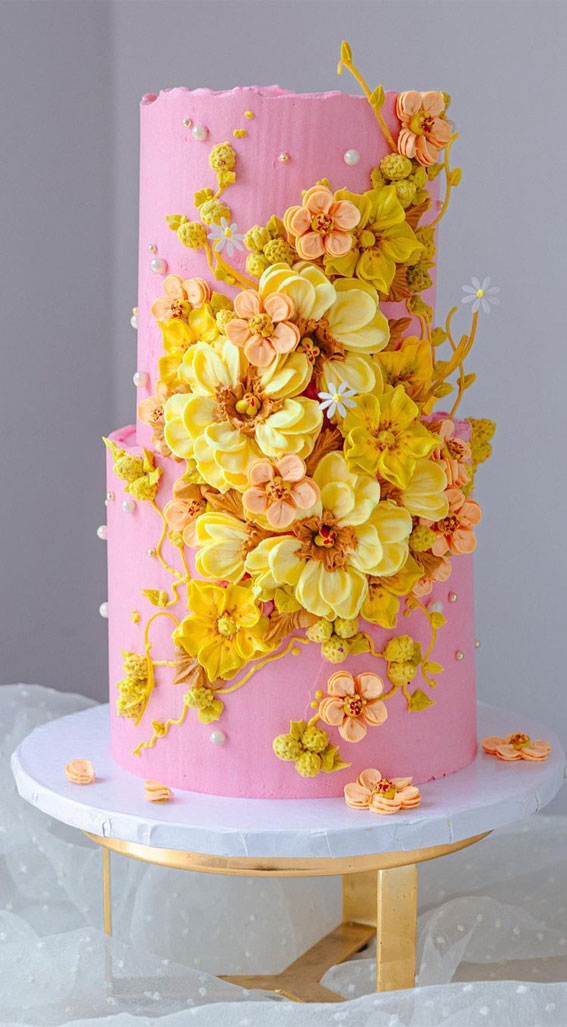
Find the location of a particular element. This screenshot has width=567, height=1027. border of circular cake stand surface is located at coordinates (15, 755), (266, 841), (527, 802), (518, 710), (84, 710).